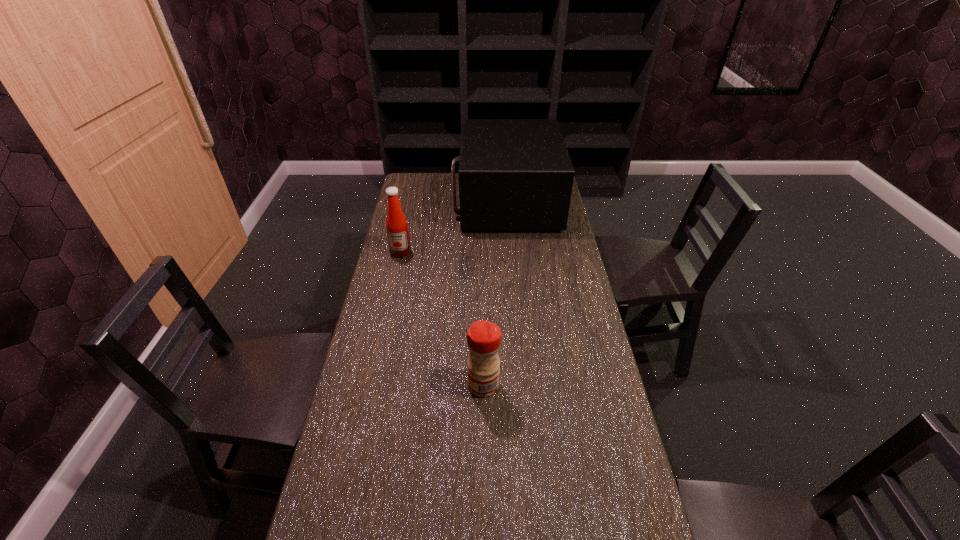
Locate an element on the screen. vacant space that satisfies the following two spatial constraints: 1. on the front-facing side of the farthest object; 2. on the front-facing side of the left condiment is located at coordinates (511, 252).

You are a GUI agent. You are given a task and a screenshot of the screen. Output one action in this format:
    pyautogui.click(x=<x>, y=<y>)
    Task: Click on the free location that satisfies the following two spatial constraints: 1. on the front-facing side of the nearest object; 2. on the right side of the second farthest object
    
    Given the screenshot: What is the action you would take?
    pyautogui.click(x=372, y=385)

Locate an element on the screen. This screenshot has width=960, height=540. vacant space that satisfies the following two spatial constraints: 1. on the front-facing side of the left condiment; 2. on the left side of the nearest object is located at coordinates (372, 385).